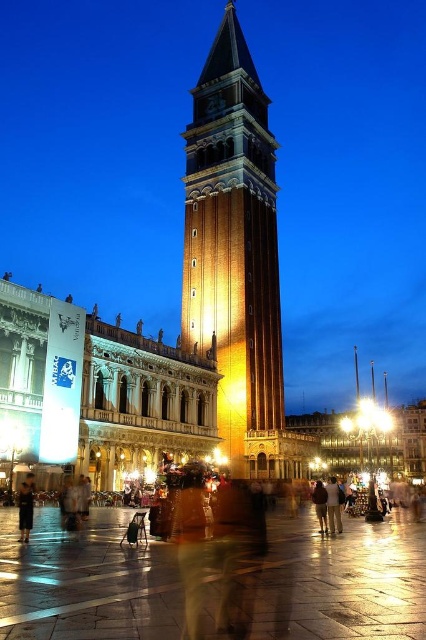
Question: Which of the following is the closest to the observer?

Choices:
 (A) tap(273, 156)
 (B) tap(340, 520)
 (C) tap(94, 611)
 (D) tap(324, 488)

Answer: (C)

Question: Which of the following is the farthest from the observer?

Choices:
 (A) (339, 508)
 (B) (250, 404)
 (C) (158, 554)
 (D) (322, 529)

Answer: (B)

Question: Is golden stone bell tower at center smaller than brown leather jacket at center?

Choices:
 (A) yes
 (B) no

Answer: (B)

Question: Which point is closer to the camera?

Choices:
 (A) brown leather jacket at center
 (B) dark brown backpack at center

Answer: (B)

Question: Does golden stone bell tower at center have a greater width compared to dark brown leather jacket at lower left?

Choices:
 (A) no
 (B) yes

Answer: (B)

Question: Can you confirm if golden stone bell tower at center is positioned to the right of dark brown backpack at center?

Choices:
 (A) yes
 (B) no

Answer: (B)